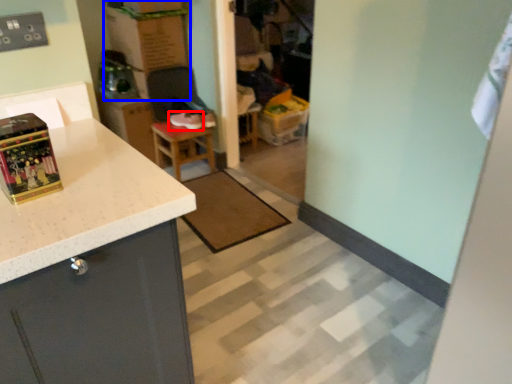
Question: Among these objects, which one is nearest to the camera, footwear (highlighted by a red box) or cardboard box (highlighted by a blue box)?

Choices:
 (A) footwear
 (B) cardboard box

Answer: (B)